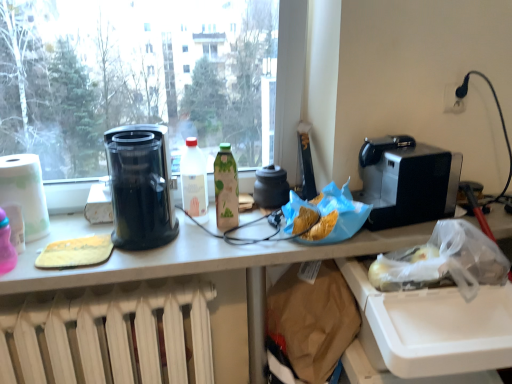
Question: In terms of height, does white radiator at lower center look taller or shorter compared to transparent glass window at upper left?

Choices:
 (A) short
 (B) tall

Answer: (A)

Question: From a real-world perspective, relative to transparent glass window at upper left, is white radiator at lower center vertically above or below?

Choices:
 (A) below
 (B) above

Answer: (A)

Question: Which of these objects is positioned farthest from the white radiator at lower center?

Choices:
 (A) green matte bottle at center, marked as the second bottle in a left-to-right arrangement
 (B) white paper towel at left
 (C) yellow sponge at left, which is the 2th food from right to left
 (D) golden crispy chips at center, which is the 1th food in right-to-left order
 (E) white glossy bottle at center, the second bottle when ordered from right to left

Answer: (D)

Question: Which object is the closest to the green matte bottle at center, marked as the second bottle in a left-to-right arrangement?

Choices:
 (A) transparent glass window at upper left
 (B) satin black coffee machine at right
 (C) matte black pot at center
 (D) white paper towel at left
 (E) white glossy bottle at center, the 1th bottle when ordered from left to right

Answer: (E)